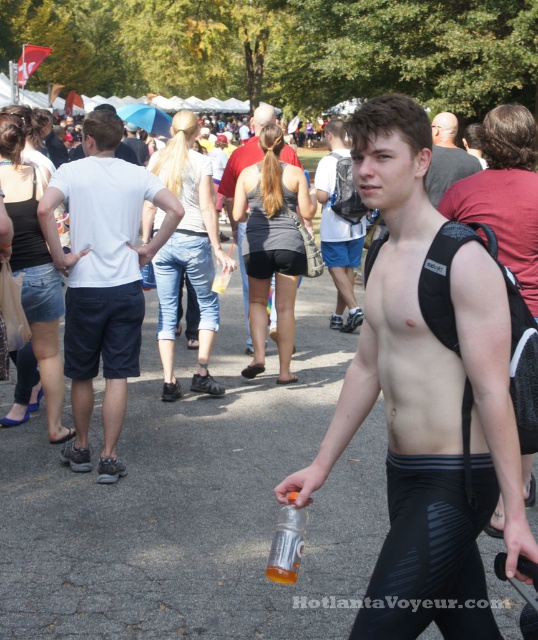
Question: Estimate the real-world distances between objects in this image. Which object is farther from the white cotton t-shirt at center?

Choices:
 (A) shiny black backpack at upper right
 (B) gray matte tank top at center
 (C) black matte tank top at center

Answer: (A)

Question: Is black matte tank top at center below translucent plastic bottle at center?

Choices:
 (A) yes
 (B) no

Answer: (B)

Question: Which point is closer to the camera?

Choices:
 (A) (88, 232)
 (B) (428, 180)

Answer: (A)

Question: Observing the image, what is the correct spatial positioning of shiny black backpack at upper right in reference to smooth bald head at center?

Choices:
 (A) right
 (B) left

Answer: (B)

Question: Considering the real-world distances, which object is farthest from the black matte tank top at center?

Choices:
 (A) translucent plastic bottle at center
 (B) shiny black backpack at upper right
 (C) gray matte tank top at center

Answer: (B)

Question: Is white cotton t-shirt at center to the left of smooth bald head at center from the viewer's perspective?

Choices:
 (A) yes
 (B) no

Answer: (A)